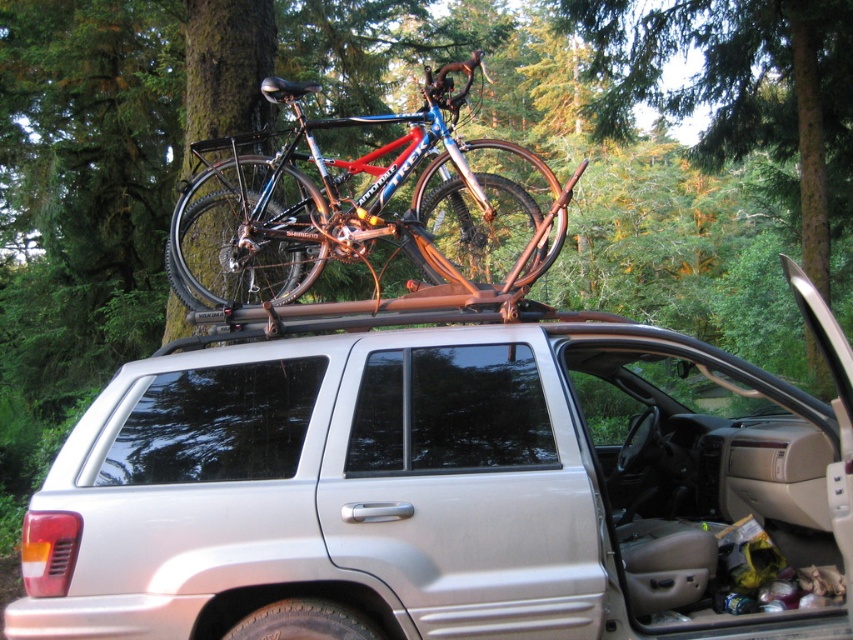
Between silver metallic suv at center and shiny metallic bicycle at center, which one is positioned higher?

Positioned higher is shiny metallic bicycle at center.

Is silver metallic suv at center to the left of shiny metallic bicycle at center from the viewer's perspective?

Indeed, silver metallic suv at center is positioned on the left side of shiny metallic bicycle at center.

Between point (701, 532) and point (519, 252), which one is positioned behind?

Positioned behind is point (519, 252).

Image resolution: width=853 pixels, height=640 pixels. Identify the location of silver metallic suv at center. (447, 484).